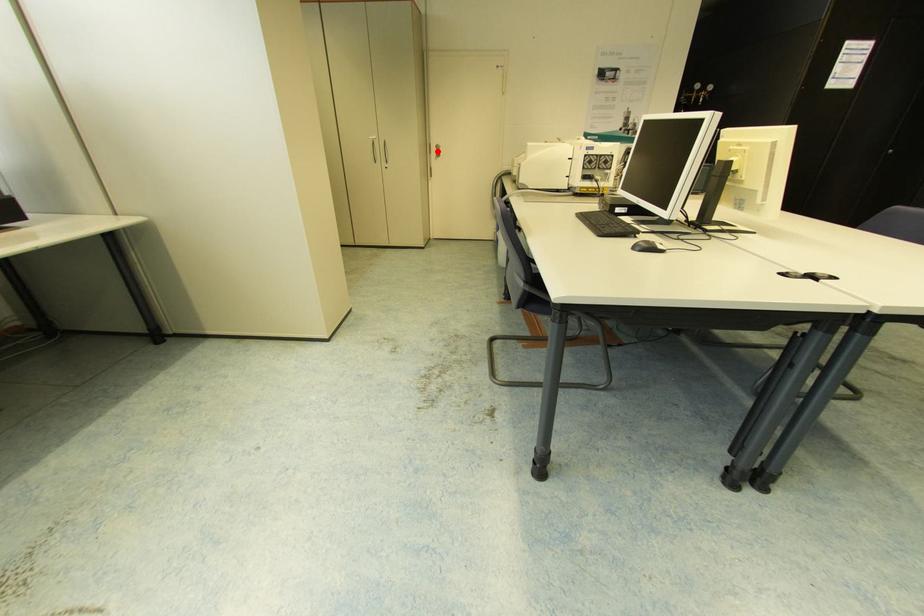
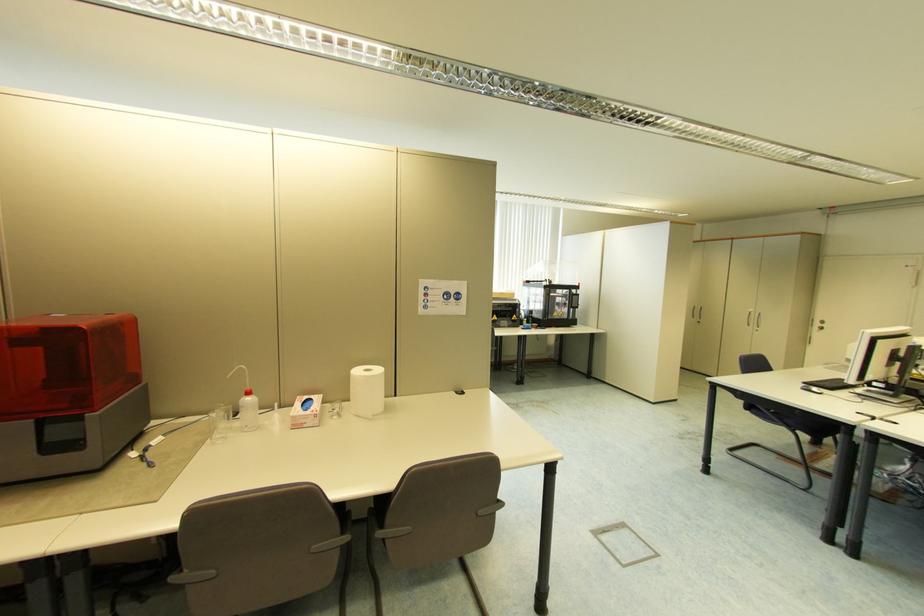
Question: I am providing you with two images of the same scene from different viewpoints. Image1 has a red point marked. In image2, the corresponding 3D location appears at what relative position? Reply with the corresponding letter.

Choices:
 (A) Closer
 (B) Farther

Answer: (B)